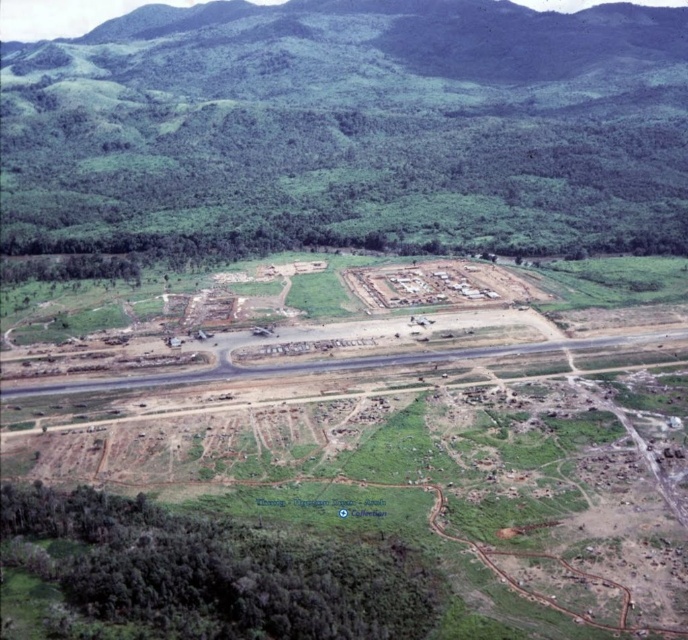
Question: Does green leafy forest at upper center appear on the left side of asphalt road at center?

Choices:
 (A) no
 (B) yes

Answer: (B)

Question: Which point is farther to the camera?

Choices:
 (A) (281, 365)
 (B) (477, 140)

Answer: (B)

Question: Is green leafy forest at upper center wider than asphalt road at center?

Choices:
 (A) yes
 (B) no

Answer: (A)

Question: Among these objects, which one is nearest to the camera?

Choices:
 (A) asphalt road at center
 (B) green leafy forest at upper center

Answer: (A)

Question: Which of the following is the farthest from the observer?

Choices:
 (A) (645, 243)
 (B) (387, 355)

Answer: (A)

Question: Can you confirm if green leafy forest at upper center is positioned to the right of asphalt road at center?

Choices:
 (A) no
 (B) yes

Answer: (A)